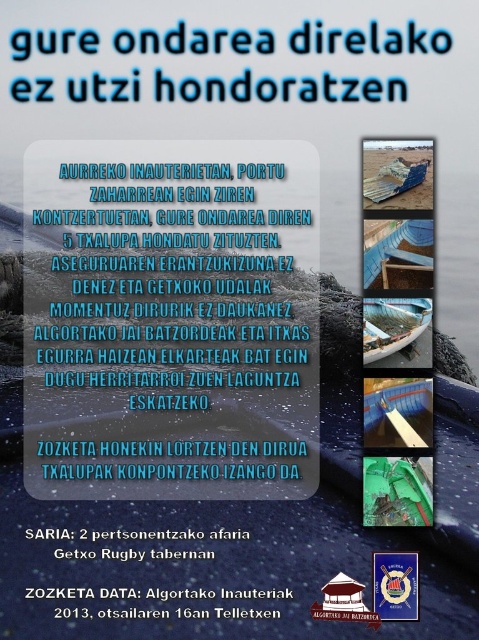
Between green plastic boat at center and blue plastic boat at center, which one has more height?

blue plastic boat at center is taller.

Is green plastic boat at center in front of blue plastic boat at center?

Yes, it is.

Is point (402, 483) in front of point (421, 396)?

That is True.

At what (x,y) coordinates should I click in order to perform the action: click on green plastic boat at center. Please return your answer as a coordinate pair (x, y). The height and width of the screenshot is (640, 479). Looking at the image, I should click on (397, 492).

Between blue plastic text at upper center and black paper text at lower center, which one appears on the right side from the viewer's perspective?

From the viewer's perspective, blue plastic text at upper center appears more on the right side.

Can you confirm if blue plastic text at upper center is positioned below black paper text at lower center?

Actually, blue plastic text at upper center is above black paper text at lower center.

Which is behind, point (350, 29) or point (171, 589)?

Point (350, 29)

Find the location of `blue plastic text at upper center`. blue plastic text at upper center is located at coordinates (367, 40).

Who is more distant from viewer, (220, 80) or (376, 440)?

Point (220, 80)

Measure the distance from blue plastic text at upper center to blue plastic boat at center.

67.03 centimeters

Identify the location of blue plastic text at upper center. Image resolution: width=479 pixels, height=640 pixels. (367, 40).